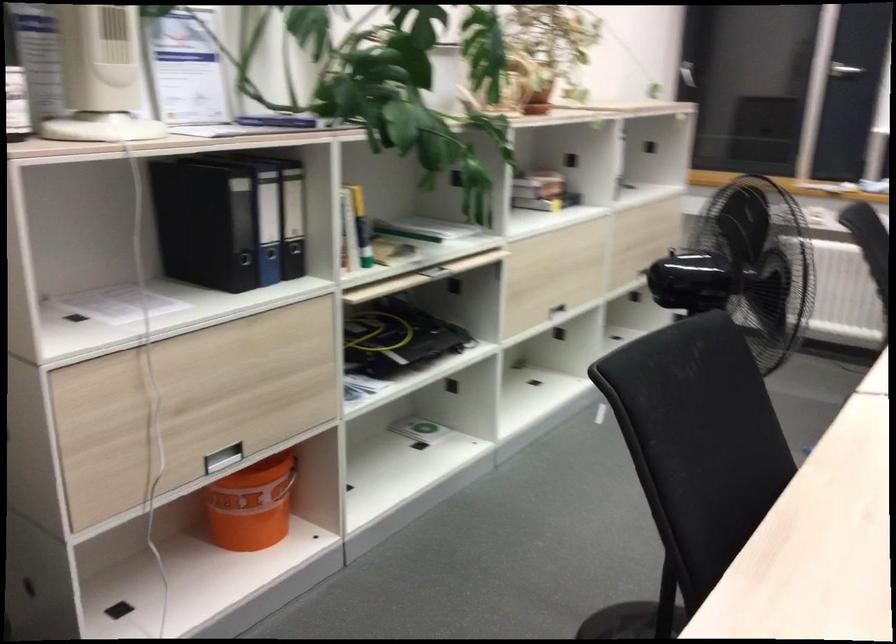
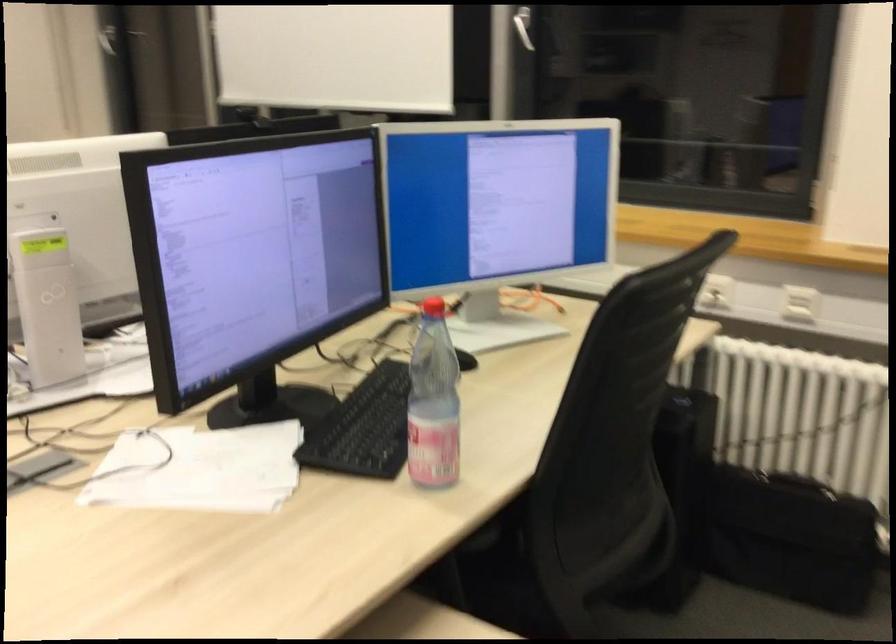
Locate, in the second image, the point that corresponds to (x=692, y=71) in the first image.

(112, 33)